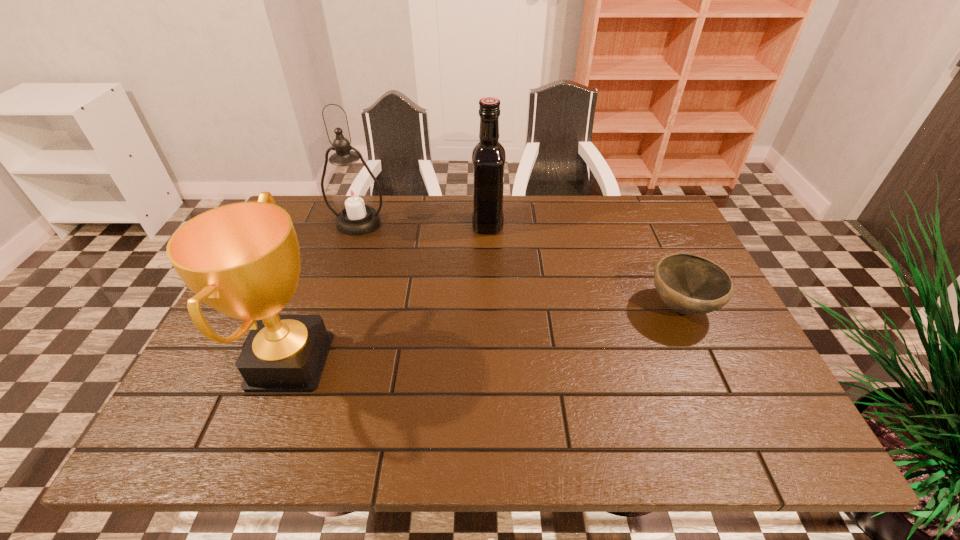
At what (x,y) coordinates should I click in order to perform the action: click on vacant area between the award and the rightmost object. Please return your answer as a coordinate pair (x, y). Image resolution: width=960 pixels, height=540 pixels. Looking at the image, I should click on (486, 334).

Identify the location of vacant space that is in between the rightmost object and the award. (486, 334).

Locate an element on the screen. This screenshot has height=540, width=960. free space between the rightmost object and the oil lamp is located at coordinates (519, 265).

Identify the location of the second closest object to the third object from left to right. (688, 284).

Choose which object is the second nearest neighbor to the liquor. Please provide its 2D coordinates. Your answer should be formatted as a tuple, i.e. [(x, y)], where the tuple contains the x and y coordinates of a point satisfying the conditions above.

[(688, 284)]

Where is `vacant region that satisfies the following two spatial constraints: 1. on the back side of the rightmost object; 2. on the front-facing side of the liquor`? vacant region that satisfies the following two spatial constraints: 1. on the back side of the rightmost object; 2. on the front-facing side of the liquor is located at coordinates (643, 224).

Find the location of a particular element. vacant point that satisfies the following two spatial constraints: 1. on the front-facing side of the rightmost object; 2. on the right side of the third object from left to right is located at coordinates (490, 307).

At what (x,y) coordinates should I click in order to perform the action: click on vacant point that satisfies the following two spatial constraints: 1. on the back side of the rightmost object; 2. on the front-facing side of the second object from right to left. Please return your answer as a coordinate pair (x, y). Looking at the image, I should click on (643, 224).

Where is `free space that satisfies the following two spatial constraints: 1. on the front-facing side of the third object from left to right; 2. on the left side of the bowl`? free space that satisfies the following two spatial constraints: 1. on the front-facing side of the third object from left to right; 2. on the left side of the bowl is located at coordinates (490, 307).